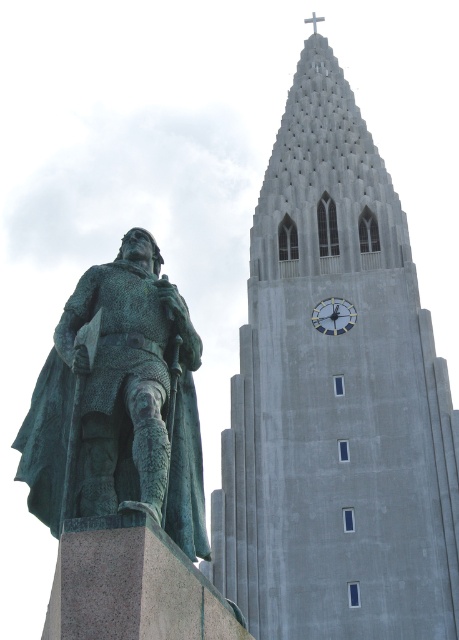
Does green patina statue at left have a lesser height compared to metallic gray clock at center?

No, green patina statue at left is not shorter than metallic gray clock at center.

Does green patina statue at left have a lesser width compared to metallic gray clock at center?

Incorrect, green patina statue at left's width is not less than metallic gray clock at center's.

Does point (34, 426) come in front of point (348, 308)?

Yes, it is.

This screenshot has width=459, height=640. Identify the location of green patina statue at left. (119, 403).

Does gray concrete tower at upper center appear on the right side of metallic gray clock at center?

Correct, you'll find gray concrete tower at upper center to the right of metallic gray clock at center.

Does gray concrete tower at upper center have a lesser width compared to metallic gray clock at center?

In fact, gray concrete tower at upper center might be wider than metallic gray clock at center.

The image size is (459, 640). Find the location of `gray concrete tower at upper center`. gray concrete tower at upper center is located at coordinates (335, 400).

What are the coordinates of `gray concrete tower at upper center` in the screenshot? It's located at (335, 400).

Looking at this image, can you confirm if gray concrete tower at upper center is smaller than green patina statue at left?

No.

Does gray concrete tower at upper center come in front of green patina statue at left?

No, it is behind green patina statue at left.

What do you see at coordinates (335, 400) in the screenshot? Image resolution: width=459 pixels, height=640 pixels. I see `gray concrete tower at upper center` at bounding box center [335, 400].

The width and height of the screenshot is (459, 640). Find the location of `gray concrete tower at upper center`. gray concrete tower at upper center is located at coordinates (335, 400).